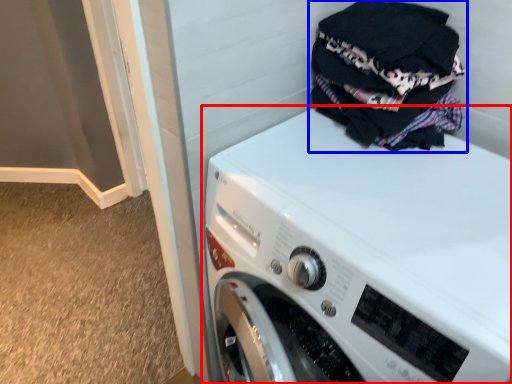
Question: Which point is further to the camera, washing machine (highlighted by a red box) or laundry (highlighted by a blue box)?

Choices:
 (A) washing machine
 (B) laundry

Answer: (B)